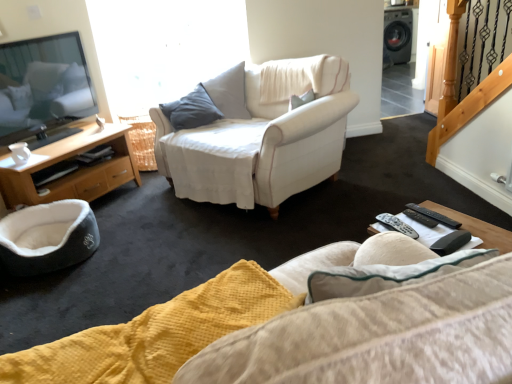
Identify the location of free point in front of dark gray plush pet bed at lower left. (47, 296).